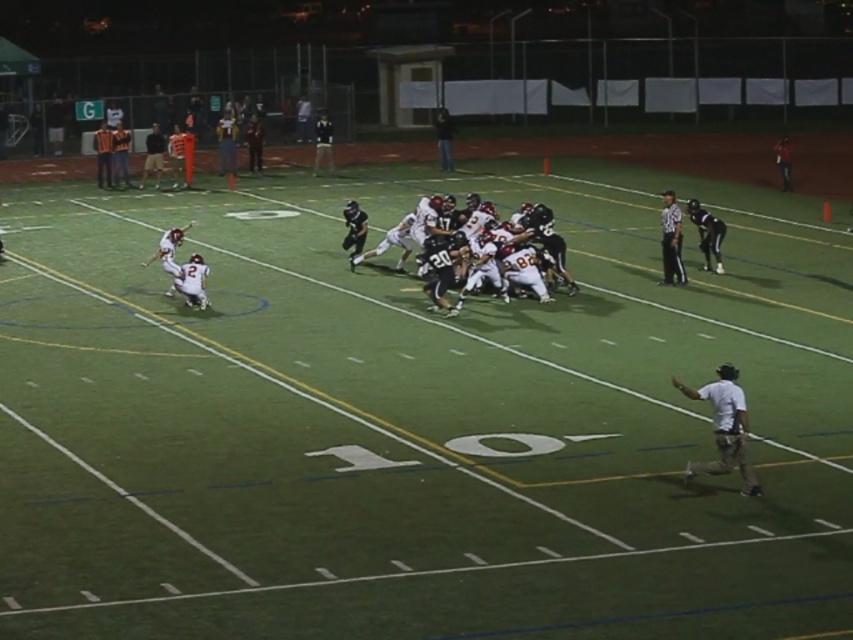
Is white matte football players at center thinner than white cotton shirt at lower right?

No.

Does point (433, 260) come in front of point (735, 372)?

No, (433, 260) is further to viewer.

At what (x,y) coordinates should I click in order to perform the action: click on white matte football players at center. Please return your answer as a coordinate pair (x, y). Image resolution: width=853 pixels, height=640 pixels. Looking at the image, I should click on (444, 253).